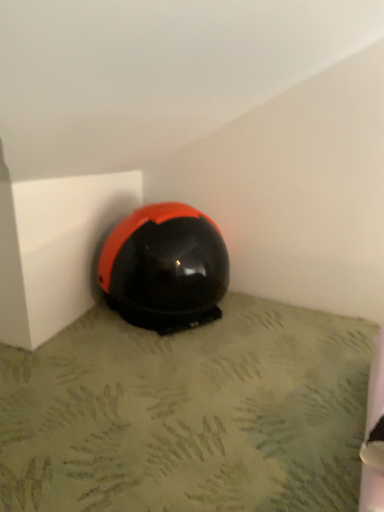
Question: Is black matte helmet at center smaller than glossy black helmet at lower center?

Choices:
 (A) yes
 (B) no

Answer: (A)

Question: From the image's perspective, would you say black matte helmet at center is shown under glossy black helmet at lower center?

Choices:
 (A) no
 (B) yes

Answer: (B)

Question: Is the depth of black matte helmet at center greater than that of glossy black helmet at lower center?

Choices:
 (A) yes
 (B) no

Answer: (B)

Question: Is glossy black helmet at lower center inside black matte helmet at center?

Choices:
 (A) yes
 (B) no

Answer: (B)

Question: Is black matte helmet at center far away from glossy black helmet at lower center?

Choices:
 (A) yes
 (B) no

Answer: (B)

Question: Does black matte helmet at center have a lesser width compared to glossy black helmet at lower center?

Choices:
 (A) no
 (B) yes

Answer: (A)

Question: Is the position of glossy black helmet at lower center more distant than that of black matte helmet at center?

Choices:
 (A) yes
 (B) no

Answer: (A)

Question: From the image's perspective, would you say glossy black helmet at lower center is shown under black matte helmet at center?

Choices:
 (A) yes
 (B) no

Answer: (B)

Question: Can you confirm if glossy black helmet at lower center is smaller than black matte helmet at center?

Choices:
 (A) yes
 (B) no

Answer: (B)

Question: Could you tell me if glossy black helmet at lower center is facing black matte helmet at center?

Choices:
 (A) yes
 (B) no

Answer: (B)

Question: From a real-world perspective, is glossy black helmet at lower center positioned over black matte helmet at center based on gravity?

Choices:
 (A) no
 (B) yes

Answer: (B)

Question: Is glossy black helmet at lower center to the right of black matte helmet at center from the viewer's perspective?

Choices:
 (A) no
 (B) yes

Answer: (A)

Question: From the image's perspective, is black matte helmet at center positioned above or below glossy black helmet at lower center?

Choices:
 (A) above
 (B) below

Answer: (B)